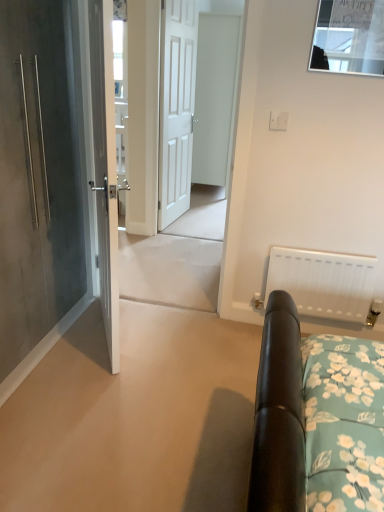
Question: Does white matte door at center, the 3th door when ordered from left to right, have a greater width compared to clear glass window at upper center?

Choices:
 (A) no
 (B) yes

Answer: (B)

Question: Is white matte door at center, marked as the second door in a right-to-left arrangement, not inside clear glass window at upper center?

Choices:
 (A) no
 (B) yes

Answer: (B)

Question: Is white matte door at center, marked as the second door in a right-to-left arrangement, positioned in front of clear glass window at upper center?

Choices:
 (A) yes
 (B) no

Answer: (B)

Question: Considering the relative sizes of white matte door at center, the 3th door when ordered from left to right, and clear glass window at upper center in the image provided, is white matte door at center, the 3th door when ordered from left to right, bigger than clear glass window at upper center?

Choices:
 (A) no
 (B) yes

Answer: (B)

Question: Is white matte door at center, the 3th door when ordered from left to right, further to the viewer compared to clear glass window at upper center?

Choices:
 (A) no
 (B) yes

Answer: (B)

Question: Can you confirm if matte gray door at left, the 4th door viewed from the right, is bigger than clear glass window at upper center?

Choices:
 (A) no
 (B) yes

Answer: (B)

Question: Can you confirm if matte gray door at left, acting as the 1th door starting from the left, is shorter than clear glass window at upper center?

Choices:
 (A) no
 (B) yes

Answer: (A)

Question: From a real-world perspective, is matte gray door at left, acting as the 1th door starting from the left, positioned under clear glass window at upper center based on gravity?

Choices:
 (A) no
 (B) yes

Answer: (B)

Question: From a real-world perspective, is matte gray door at left, acting as the 1th door starting from the left, on top of clear glass window at upper center?

Choices:
 (A) yes
 (B) no

Answer: (B)

Question: Is the depth of matte gray door at left, the 4th door viewed from the right, greater than that of clear glass window at upper center?

Choices:
 (A) no
 (B) yes

Answer: (A)

Question: Can you confirm if matte gray door at left, the 4th door viewed from the right, is taller than clear glass window at upper center?

Choices:
 (A) no
 (B) yes

Answer: (B)

Question: Can you confirm if clear glass window at upper center is wider than white wooden door at center?

Choices:
 (A) yes
 (B) no

Answer: (B)